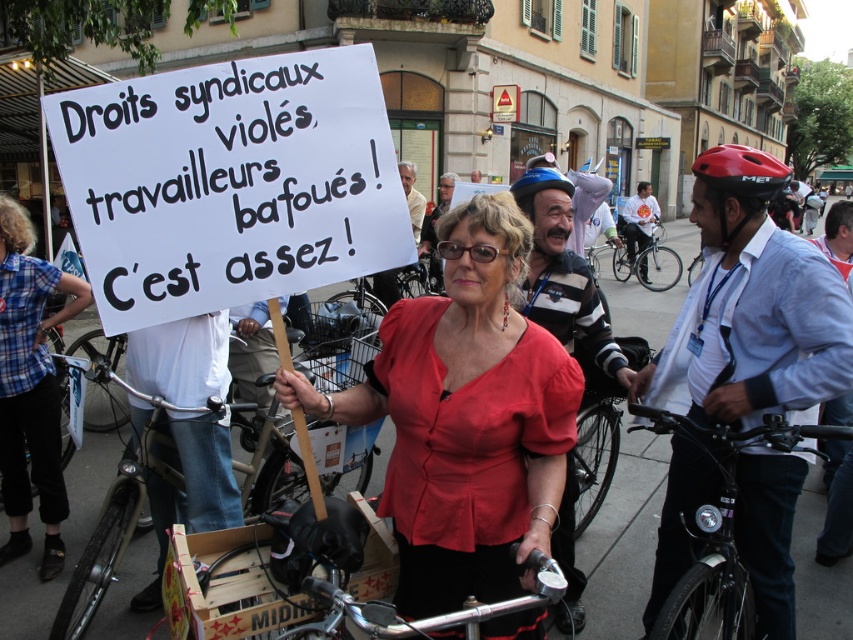
Between point (772, 260) and point (643, 262), which one is positioned behind?

Positioned behind is point (643, 262).

Does red helmet at center lie in front of silver metallic bicycle at center?

That is True.

The height and width of the screenshot is (640, 853). In order to click on red helmet at center in this screenshot , I will do click(750, 307).

Does point (67, 598) lie behind point (392, 628)?

Yes, it is behind point (392, 628).

Does wooden crate at center have a smaller size compared to polished chrome handlebars at center?

No.

The image size is (853, 640). Find the location of `wooden crate at center`. wooden crate at center is located at coordinates (103, 548).

Can you confirm if red helmet at center is smaller than red matte bicycle helmet at right?

Yes.

Is red helmet at center in front of red matte bicycle helmet at right?

Yes, it is in front of red matte bicycle helmet at right.

Where is `red helmet at center`? red helmet at center is located at coordinates (750, 307).